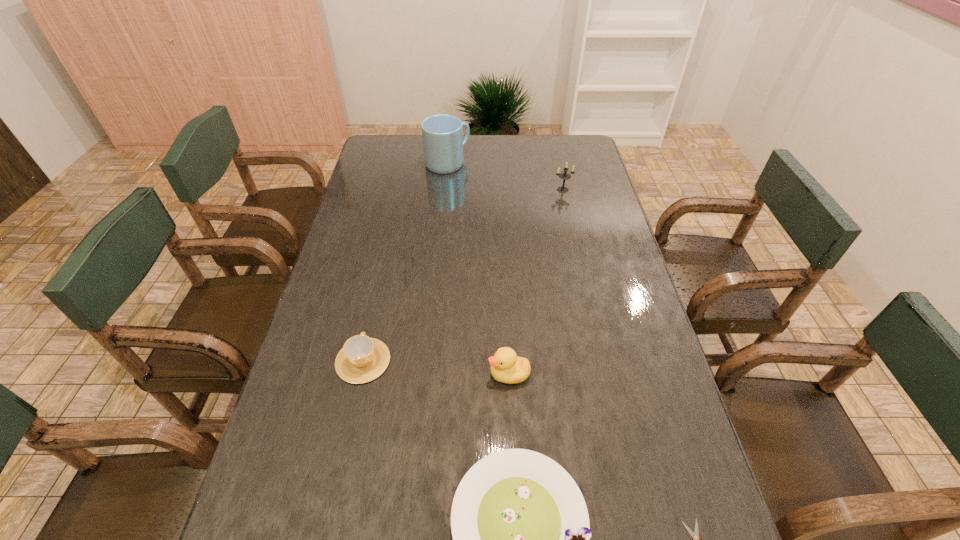
Image resolution: width=960 pixels, height=540 pixels. I want to click on vacant space located 0.130m at the beak of the duck, so click(434, 374).

What are the coordinates of `free space located 0.380m at the beak of the duck` in the screenshot? It's located at (331, 374).

You are a GUI agent. You are given a task and a screenshot of the screen. Output one action in this format:
    pyautogui.click(x=<x>, y=<y>)
    Task: Click on the free region located with the handle on the side of the third shortest object
    
    Given the screenshot: What is the action you would take?
    pyautogui.click(x=380, y=282)

You are a GUI agent. You are given a task and a screenshot of the screen. Output one action in this format:
    pyautogui.click(x=<x>, y=<y>)
    Task: Click on the vacant space located 0.270m with the handle on the side of the third shortest object
    This screenshot has width=960, height=540.
    Given the screenshot: What is the action you would take?
    pyautogui.click(x=384, y=266)

Identify the location of vacant position located 0.340m with the handle on the side of the third shortest object. (387, 250).

Image resolution: width=960 pixels, height=540 pixels. Find the location of `object at the far edge`. object at the far edge is located at coordinates (442, 135).

Where is `object located at the left edge`? This screenshot has height=540, width=960. object located at the left edge is located at coordinates (362, 359).

The width and height of the screenshot is (960, 540). I want to click on object that is at the right edge, so click(565, 176).

The height and width of the screenshot is (540, 960). I want to click on free space at the far edge, so click(x=502, y=138).

Locate an element on the screen. This screenshot has height=540, width=960. free space at the left edge of the desktop is located at coordinates (332, 261).